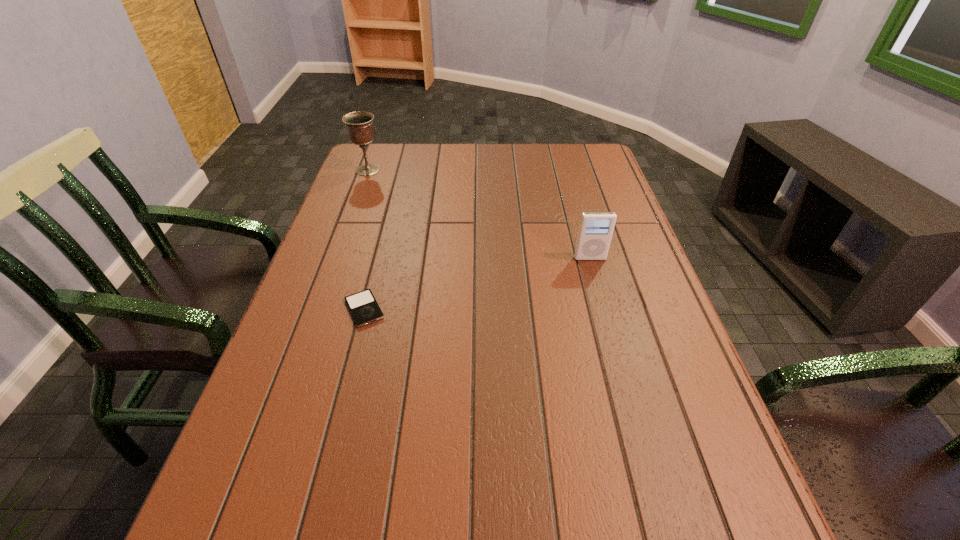
This screenshot has height=540, width=960. I want to click on chalice, so click(359, 125).

Find the location of a particular element. the farthest object is located at coordinates (359, 125).

The image size is (960, 540). I want to click on the second shortest object, so click(x=596, y=229).

Identify the location of the second farthest object. (596, 229).

Where is `the second object from left to right`? This screenshot has height=540, width=960. the second object from left to right is located at coordinates (363, 306).

Where is `the shortest object`? The width and height of the screenshot is (960, 540). the shortest object is located at coordinates (363, 306).

Where is `vacant position located 0.150m on the right of the chalice`? vacant position located 0.150m on the right of the chalice is located at coordinates (429, 170).

This screenshot has height=540, width=960. I want to click on vacant position located on the front-facing side of the taller iPod, so click(x=604, y=308).

Find the location of a particular element. This screenshot has width=960, height=540. free space located 0.050m on the left of the second object from left to right is located at coordinates (320, 309).

Find the location of a particular element. The image size is (960, 540). object at the far edge is located at coordinates (359, 125).